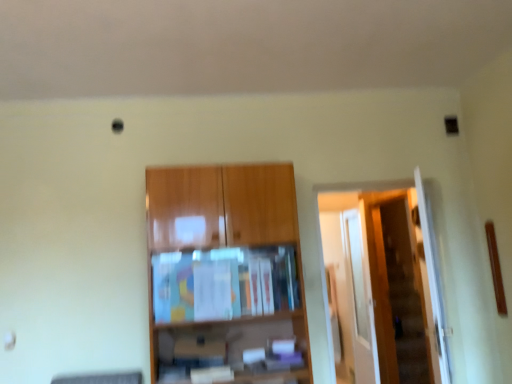
What do you see at coordinates (226, 271) in the screenshot? The height and width of the screenshot is (384, 512). I see `wooden cabinet at center` at bounding box center [226, 271].

What do you see at coordinates (388, 277) in the screenshot?
I see `wooden door at right` at bounding box center [388, 277].

Where is `wooden cabinet at center`? The height and width of the screenshot is (384, 512). wooden cabinet at center is located at coordinates (226, 271).

From the picture: Considering the relative sizes of transparent glass door at right and wooden door at right in the image provided, is transparent glass door at right shorter than wooden door at right?

In fact, transparent glass door at right may be taller than wooden door at right.

From the picture: Is transparent glass door at right looking in the opposite direction of wooden door at right?

No, transparent glass door at right's orientation is not away from wooden door at right.

Is transparent glass door at right behind wooden door at right?

Yes.

Is wooden door at right completely or partially inside transparent glass door at right?

No, wooden door at right is located outside of transparent glass door at right.

Which point is more forward, (367,276) or (257,241)?

Positioned in front is point (257,241).

Looking at this image, from a real-world perspective, is transparent glass door at right physically below wooden cabinet at center?

Yes, from a real-world perspective, transparent glass door at right is beneath wooden cabinet at center.

From the image's perspective, which one is positioned higher, transparent glass door at right or wooden cabinet at center?

wooden cabinet at center appears higher in the image.

Identify the location of cupboard located on the left of transparent glass door at right. The width and height of the screenshot is (512, 384). (226, 271).

From a real-world perspective, is wooden door at right beneath transparent glass door at right?

Actually, wooden door at right is physically above transparent glass door at right in the real world.

Considering their positions, is wooden door at right located in front of or behind transparent glass door at right?

wooden door at right is positioned closer to the viewer than transparent glass door at right.

Is point (358, 238) in front of point (366, 259)?

No, it is behind (366, 259).

Is wooden door at right wider or thinner than transparent glass door at right?

wooden door at right is wider than transparent glass door at right.

From the image's perspective, does wooden cabinet at center appear lower than transparent glass door at right?

No, from the image's perspective, wooden cabinet at center is not beneath transparent glass door at right.

Identify the location of cupboard on the left of transparent glass door at right. (226, 271).

Between point (154, 355) and point (376, 364), which one is positioned behind?

The point (376, 364) is farther.

Would you consider wooden cabinet at center to be distant from transparent glass door at right?

Absolutely, wooden cabinet at center is distant from transparent glass door at right.

Identify the location of door below the wooden cabinet at center (from the image's perspective). (388, 277).

Consider the image. Considering the relative positions of wooden cabinet at center and wooden door at right in the image provided, is wooden cabinet at center to the left or to the right of wooden door at right?

Clearly, wooden cabinet at center is on the left of wooden door at right in the image.

Is wooden cabinet at center located outside wooden door at right?

Yes.

From a real-world perspective, is wooden door at right physically located above or below wooden cabinet at center?

In terms of real-world spatial position, wooden door at right is below wooden cabinet at center.

Can you confirm if wooden door at right is bigger than wooden cabinet at center?

Incorrect, wooden door at right is not larger than wooden cabinet at center.

Is wooden door at right facing away from wooden cabinet at center?

No, wooden door at right's orientation is not away from wooden cabinet at center.

Is wooden door at right not near wooden cabinet at center?

Indeed, wooden door at right is not near wooden cabinet at center.

Where is `glass door to the right of wooden door at right`? The height and width of the screenshot is (384, 512). glass door to the right of wooden door at right is located at coordinates tap(360, 300).

In the image, there is a transparent glass door at right. Where is `cupboard above it (from the image's perspective)`? The width and height of the screenshot is (512, 384). cupboard above it (from the image's perspective) is located at coordinates (226, 271).

Based on the photo, which object lies further to the anchor point transparent glass door at right, wooden cabinet at center or wooden door at right?

wooden cabinet at center lies further to transparent glass door at right than the other object.

Based on their spatial positions, is transparent glass door at right or wooden door at right further from wooden cabinet at center?

Based on the image, transparent glass door at right appears to be further to wooden cabinet at center.

Based on their spatial positions, is wooden door at right or wooden cabinet at center closer to transparent glass door at right?

wooden door at right.

Estimate the real-world distances between objects in this image. Which object is further from wooden door at right, wooden cabinet at center or transparent glass door at right?

Based on the image, wooden cabinet at center appears to be further to wooden door at right.

From the image, which object appears to be nearer to wooden cabinet at center, wooden door at right or transparent glass door at right?

wooden door at right is closer to wooden cabinet at center.

Estimate the real-world distances between objects in this image. Which object is closer to wooden door at right, transparent glass door at right or wooden cabinet at center?

The object closer to wooden door at right is transparent glass door at right.

Where is `door between wooden cabinet at center and transparent glass door at right from front to back`? door between wooden cabinet at center and transparent glass door at right from front to back is located at coordinates (388, 277).